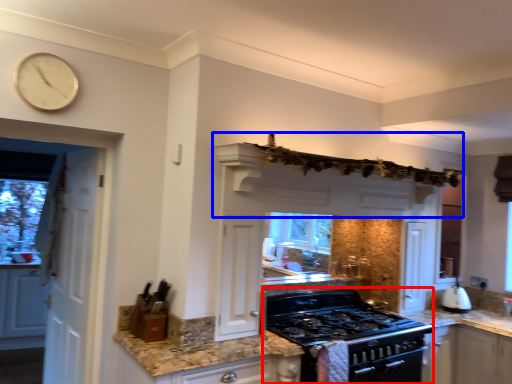
Question: Which object is closer to the camera taking this photo, appliance (highlighted by a red box) or exhaust hood (highlighted by a blue box)?

Choices:
 (A) appliance
 (B) exhaust hood

Answer: (B)